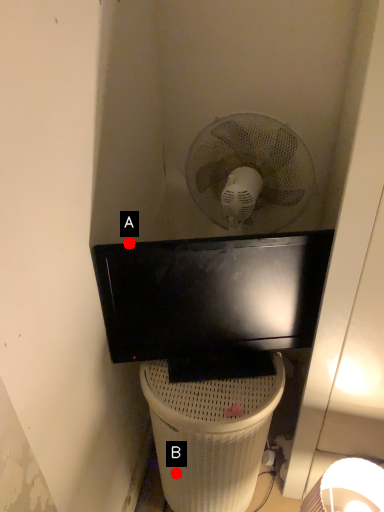
Question: Two points are circled on the image, labeled by A and B beside each circle. Among these points, which one is farthest from the camera?

Choices:
 (A) A is further
 (B) B is further

Answer: (B)